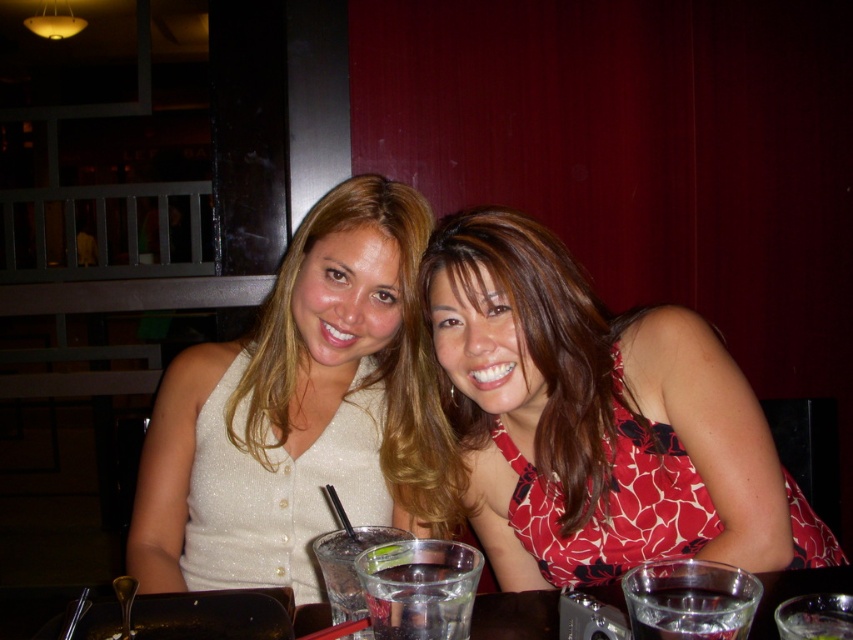
You are a photographer taking a picture of the two women at the table. You notice a point at coordinates (x=277, y=492). What object is located at this point?

The point at coordinates (x=277, y=492) marks the white sparkly dress at center.

You are a photographer trying to capture a closeup shot of both the white glittery top at center and the red floral dress at center. Given that your camera lens has a maximum focus range of 12 inches, will you be able to focus on both subjects simultaneously?

The white glittery top at center and the red floral dress at center are 11.73 inches apart from each other. Since the distance between them is within the camera lens maximum focus range of 12 inches, the photographer can focus on both subjects simultaneously.